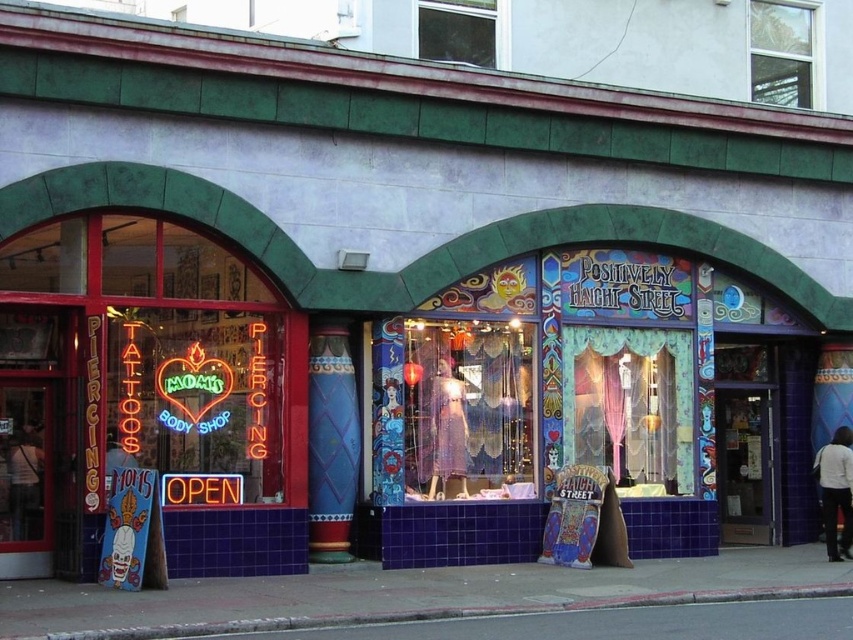
This screenshot has height=640, width=853. Identify the location of translucent fabric dress at center. (453, 410).

From the picture: Is translucent fabric dress at center thinner than concrete at lower center?

Indeed, translucent fabric dress at center has a lesser width compared to concrete at lower center.

Is point (381, 472) farther from viewer compared to point (427, 612)?

Yes.

Image resolution: width=853 pixels, height=640 pixels. What are the coordinates of `translucent fabric dress at center` in the screenshot? It's located at (453, 410).

Which is more to the left, metallic sequined dress at center or white t-shirt at left?

Positioned to the left is white t-shirt at left.

In the scene shown: Who is higher up, metallic sequined dress at center or white t-shirt at left?

metallic sequined dress at center is higher up.

Is point (456, 410) positioned in front of point (19, 513)?

No.

The width and height of the screenshot is (853, 640). Identify the location of metallic sequined dress at center. (447, 429).

Who is positioned more to the left, concrete at lower center or metallic sequined dress at center?

Positioned to the left is metallic sequined dress at center.

You are a GUI agent. You are given a task and a screenshot of the screen. Output one action in this format:
    pyautogui.click(x=<x>, y=<y>)
    Task: Click on the concrete at lower center
    The height and width of the screenshot is (640, 853).
    Given the screenshot: What is the action you would take?
    pyautogui.click(x=456, y=612)

Find the location of `concrete at lower center`. concrete at lower center is located at coordinates (456, 612).